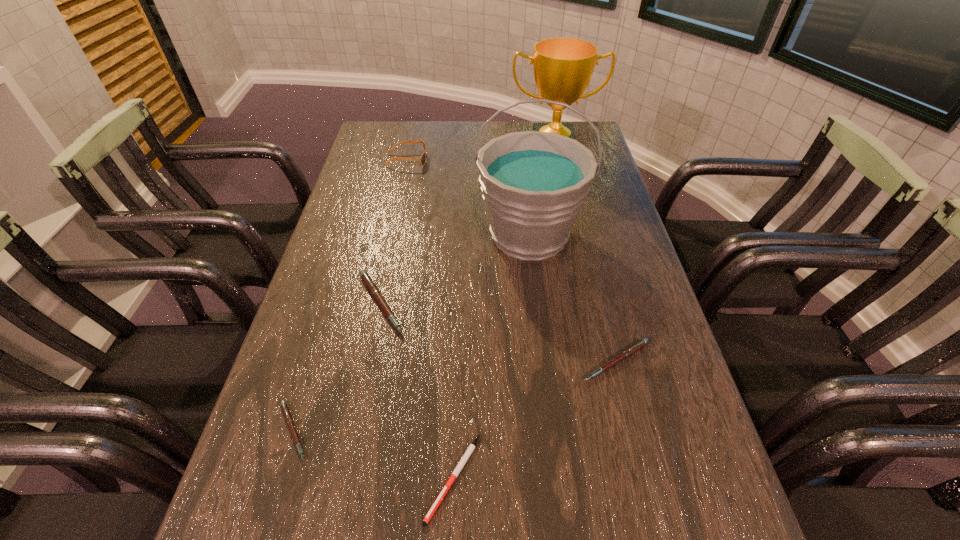
You are a GUI agent. You are given a task and a screenshot of the screen. Output one action in this format:
    pyautogui.click(x=<x>, y=<y>)
    Task: Click on the empty space between the farthest pink pen and the nearest pink pen
    The width and height of the screenshot is (960, 540).
    Given the screenshot: What is the action you would take?
    coord(337,367)

You are a GUI agent. You are given a task and a screenshot of the screen. Output one action in this format:
    pyautogui.click(x=<x>, y=<y>)
    Task: Click on the empty location between the sunglasses and the third shortest pen
    The height and width of the screenshot is (540, 960).
    Given the screenshot: What is the action you would take?
    pyautogui.click(x=512, y=260)

I want to click on unoccupied area between the leftmost pink pen and the white pen, so click(x=373, y=455).

Where is `vacant area between the gold award and the third nearest pen`? This screenshot has width=960, height=540. vacant area between the gold award and the third nearest pen is located at coordinates (585, 256).

Locate an element on the screen. This screenshot has width=960, height=540. vacant space that's between the blue bucket and the second tallest pen is located at coordinates (573, 298).

At what (x,y) coordinates should I click in order to perform the action: click on free spot between the white pen and the award. Please return your answer as a coordinate pair (x, y). The image size is (960, 540). Looking at the image, I should click on [x=503, y=315].

Locate an element on the screen. The image size is (960, 540). blank region between the award and the fourth farthest object is located at coordinates (467, 227).

Identify the location of empty space between the fifth shortest object and the farthest pink pen. (394, 232).

Select which object is the second closest to the gold award. Please provide its 2D coordinates. Your answer should be formatted as a tuple, i.e. [(x, y)], where the tuple contains the x and y coordinates of a point satisfying the conditions above.

[(422, 159)]

Identify which object is located as the fifth nearest to the third shortest object. Please provide its 2D coordinates. Your answer should be formatted as a tuple, i.e. [(x, y)], where the tuple contains the x and y coordinates of a point satisfying the conditions above.

[(563, 67)]